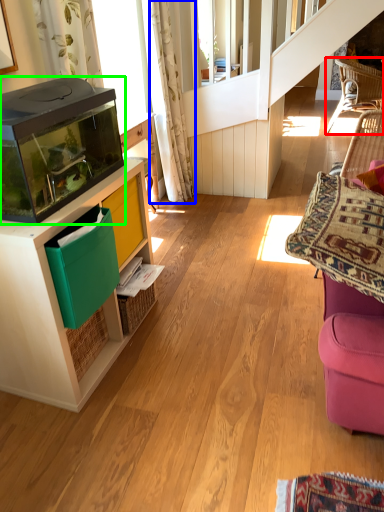
Question: Which object is positioned farthest from chair (highlighted by a red box)? Select from curtain (highlighted by a blue box) and appliance (highlighted by a green box).

Choices:
 (A) curtain
 (B) appliance

Answer: (B)